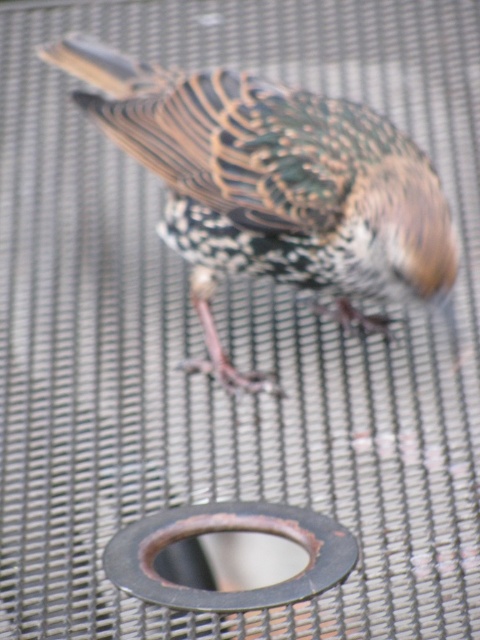
Can you confirm if speckled feathered bird at center is bigger than rusty metal drain at center?

Yes.

Who is lower down, speckled feathered bird at center or rusty metal drain at center?

rusty metal drain at center is below.

Does point (96, 97) come behind point (186, 516)?

Yes, it is.

Where is `speckled feathered bird at center`? speckled feathered bird at center is located at coordinates (274, 188).